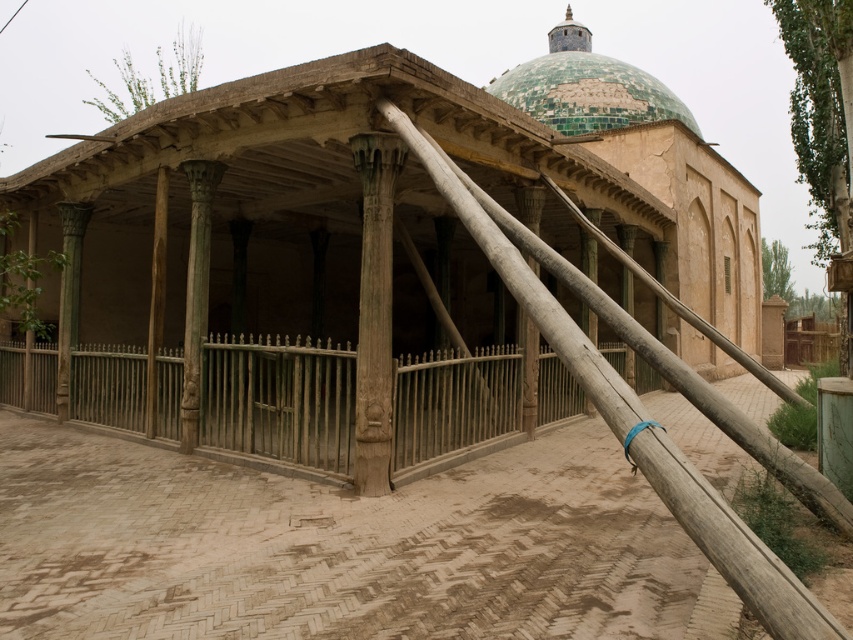
You are standing at the entrance of the old building and want to walk towards the point marked as point (68, 400). However, there is an obstacle located at point (669, 104). Will you encounter this obstacle on your path?

Since point (68, 400) is in front of point (669, 104), you will not encounter the obstacle at point (669, 104) on your path towards point (68, 400).

Based on the photo, you are standing in front of the old architectural structure. You see a wooden hut at center and a wooden fence at center. Which one is taller?

The wooden hut at center is taller than the wooden fence at center.

You are planning to set up a small tea stall in the shaded area under the wooden beams. The wooden hut at center and wooden fence at center are in the way. Which one should you move first if you want to maximize the available space?

You should move the wooden hut at center first because it is bigger than the wooden fence at center, so removing it would free up more space.